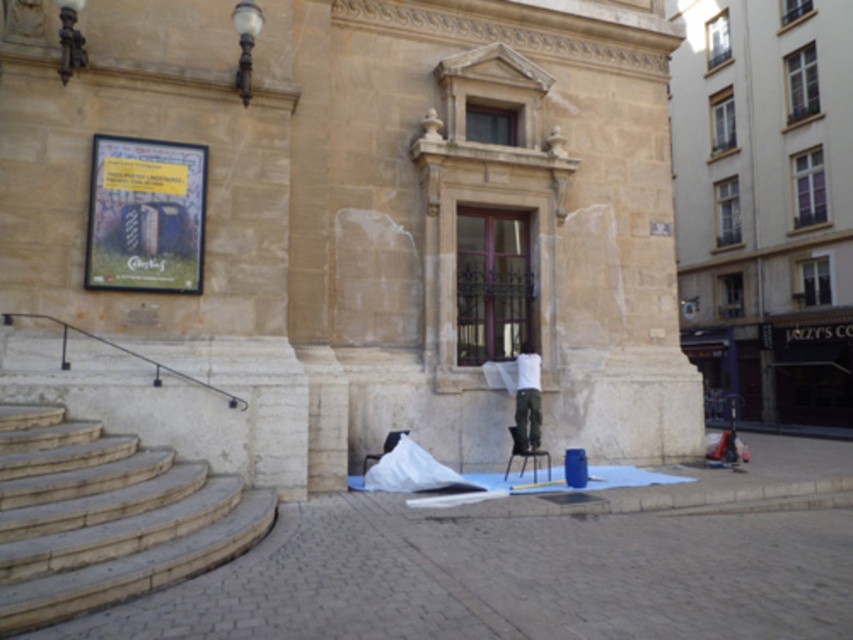
Question: Which of these objects is positioned farthest from the white matte shirt at center?

Choices:
 (A) paved stone pavement at lower center
 (B) wooden stairs at lower left

Answer: (A)

Question: Is paved stone pavement at lower center thinner than white matte shirt at center?

Choices:
 (A) yes
 (B) no

Answer: (B)

Question: Among these objects, which one is farthest from the camera?

Choices:
 (A) wooden stairs at lower left
 (B) paved stone pavement at lower center

Answer: (B)

Question: Is wooden stairs at lower left wider than white matte shirt at center?

Choices:
 (A) yes
 (B) no

Answer: (A)

Question: Does paved stone pavement at lower center have a greater width compared to wooden stairs at lower left?

Choices:
 (A) yes
 (B) no

Answer: (A)

Question: Based on their relative distances, which object is farther from the white matte shirt at center?

Choices:
 (A) wooden stairs at lower left
 (B) paved stone pavement at lower center

Answer: (B)